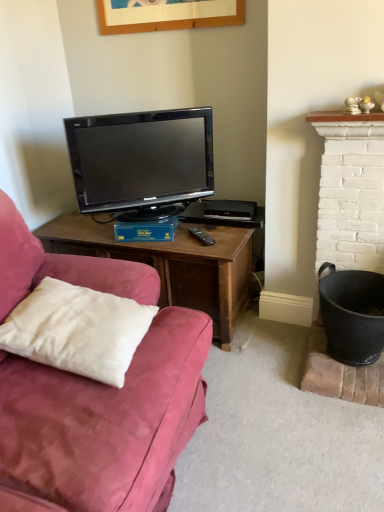
Question: From a real-world perspective, relative to white soft pillow at lower left, is black glossy television at center vertically above or below?

Choices:
 (A) above
 (B) below

Answer: (A)

Question: Is black glossy television at center in front of or behind white soft pillow at lower left in the image?

Choices:
 (A) behind
 (B) front

Answer: (A)

Question: From the image's perspective, is black glossy television at center located above or below white soft pillow at lower left?

Choices:
 (A) above
 (B) below

Answer: (A)

Question: Is white soft pillow at lower left inside or outside of black glossy television at center?

Choices:
 (A) inside
 (B) outside

Answer: (B)

Question: In terms of height, does white soft pillow at lower left look taller or shorter compared to black glossy television at center?

Choices:
 (A) tall
 (B) short

Answer: (B)

Question: Does point (69, 365) appear closer or farther from the camera than point (148, 122)?

Choices:
 (A) closer
 (B) farther

Answer: (A)

Question: From a real-world perspective, is white soft pillow at lower left positioned above or below black glossy television at center?

Choices:
 (A) above
 (B) below

Answer: (B)